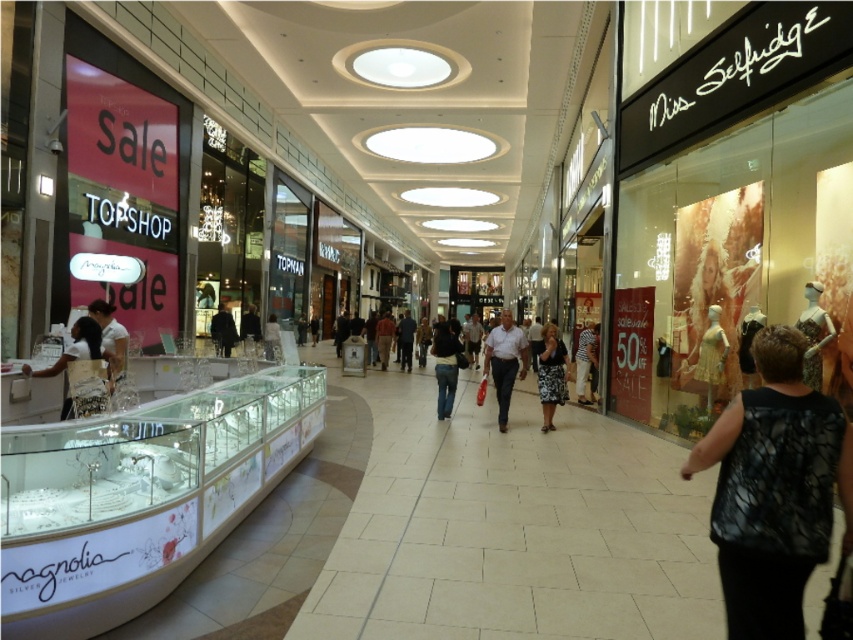
Question: Can you confirm if white fabric bag at lower left is wider than white matte mannequin at right?

Choices:
 (A) yes
 (B) no

Answer: (A)

Question: Which object is positioned farthest from the white shirt at left?

Choices:
 (A) dark wool coat at center
 (B) white fabric bag at lower left
 (C) black mesh vest at center
 (D) dark gray fabric jacket at center

Answer: (D)

Question: Based on their relative distances, which object is nearer to the dark gray fabric jacket at center?

Choices:
 (A) black floral dress at center
 (B) white shirt at left
 (C) white matte mannequin at right
 (D) light brown leather pants at center

Answer: (D)

Question: Which of the following is the closest to the observer?

Choices:
 (A) (805, 374)
 (B) (578, 340)
 (C) (229, 323)
 (D) (102, 316)

Answer: (D)

Question: In this image, where is white matte mannequin at right located relative to dark blue jeans at center?

Choices:
 (A) right
 (B) left

Answer: (A)

Question: Does black floral dress at center have a lesser width compared to dark blue jeans at center?

Choices:
 (A) no
 (B) yes

Answer: (A)